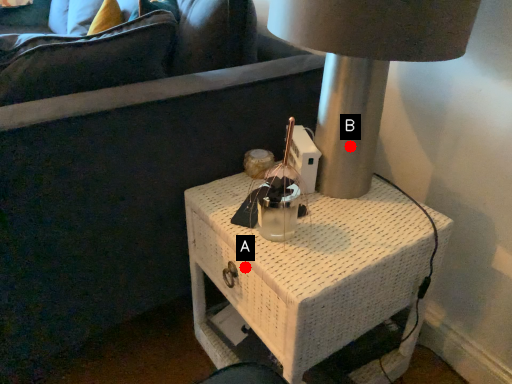
Question: Two points are circled on the image, labeled by A and B beside each circle. Which point appears closest to the camera in this image?

Choices:
 (A) A is closer
 (B) B is closer

Answer: (A)